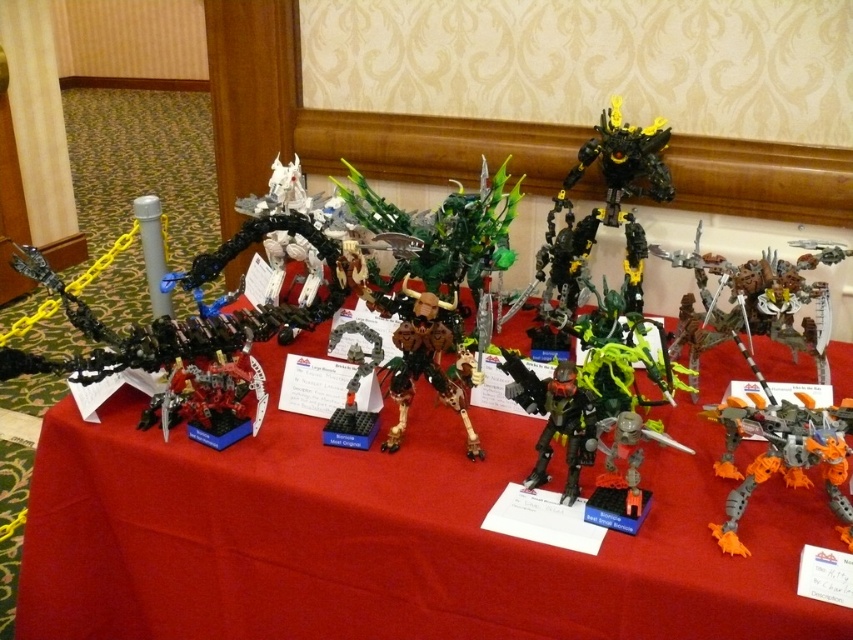
Question: Does red fabric tablecloth at center have a smaller size compared to shiny black armor at center?

Choices:
 (A) no
 (B) yes

Answer: (A)

Question: Which point is closer to the camera?

Choices:
 (A) (212, 596)
 (B) (755, 426)

Answer: (B)

Question: Estimate the real-world distances between objects in this image. Which object is farther from the red fabric tablecloth at center?

Choices:
 (A) orange matte robot at lower right
 (B) shiny black armor at center

Answer: (A)

Question: Which point is farther to the camera?

Choices:
 (A) (775, 433)
 (B) (525, 381)

Answer: (B)

Question: Is red fabric tablecloth at center smaller than orange matte robot at lower right?

Choices:
 (A) yes
 (B) no

Answer: (B)

Question: Is red fabric tablecloth at center closer to the viewer compared to orange matte robot at lower right?

Choices:
 (A) no
 (B) yes

Answer: (B)